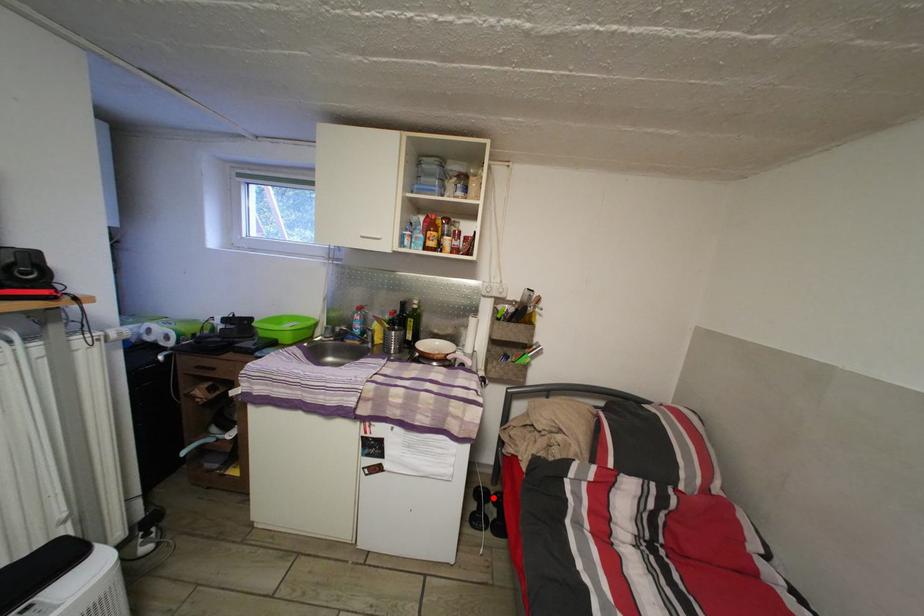
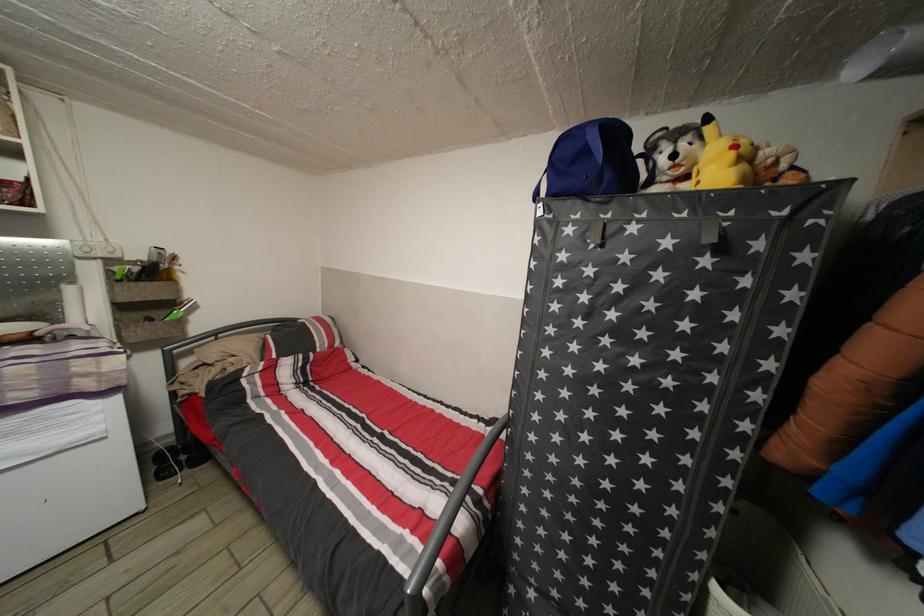
Where in the second image is the point corresponding to the highlighted location from the first image?

(177, 455)